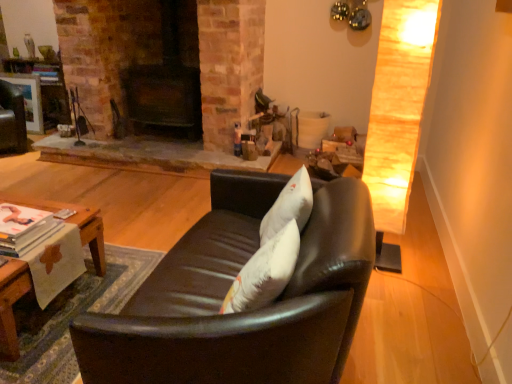
Question: From a real-world perspective, relative to matte black swivel chair at upper left, is woodenwoodentable at lower left vertically above or below?

Choices:
 (A) above
 (B) below

Answer: (B)

Question: Is woodenwoodentable at lower left bigger or smaller than matte black swivel chair at upper left?

Choices:
 (A) big
 (B) small

Answer: (A)

Question: Which object is positioned farthest from the matte black swivel chair at upper left?

Choices:
 (A) black leather couch at center
 (B) woodenwoodentable at lower left

Answer: (A)

Question: Based on their relative distances, which object is nearer to the woodenwoodentable at lower left?

Choices:
 (A) matte black swivel chair at upper left
 (B) black leather couch at center

Answer: (B)